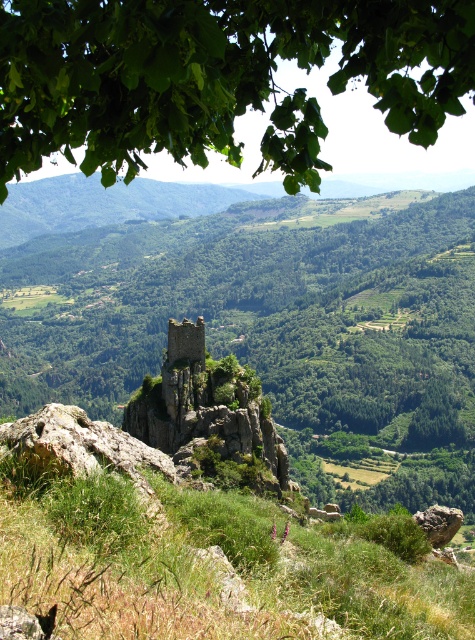
You are standing at the viewpoint overlooking the mountain landscape. There are two points marked in the image, one at coordinates point (11, 168) and the other at point (330, 620). Which of these two points is closer to your current position?

Point (11, 168) is closer to the viewer than point (330, 620).

In the scene shown: Based on the scene description, where is the green leafy tree at center located in terms of coordinates?

The green leafy tree at center is located at point coordinates of (272, 324).

You are a hiker trying to determine which area has more coverage between the green leafy tree at upper center and the green grassy at center. Based on the scene, which one covers a larger area?

The green grassy at center covers a larger area than the green leafy tree at upper center because the green leafy tree at upper center occupies less space than green grassy at center.